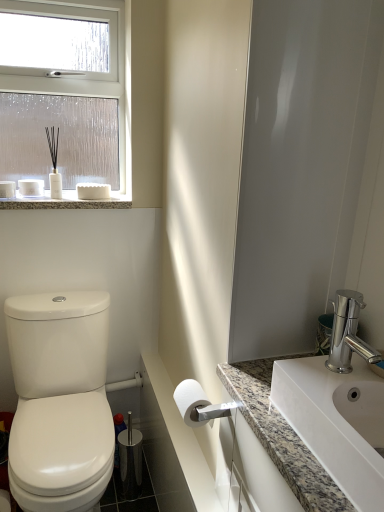
Where is `free location above white marble countertop at lower center, the 2th counter top in the right-to-left sequence (from a real-world perspective)`? This screenshot has height=512, width=384. free location above white marble countertop at lower center, the 2th counter top in the right-to-left sequence (from a real-world perspective) is located at coordinates (178, 423).